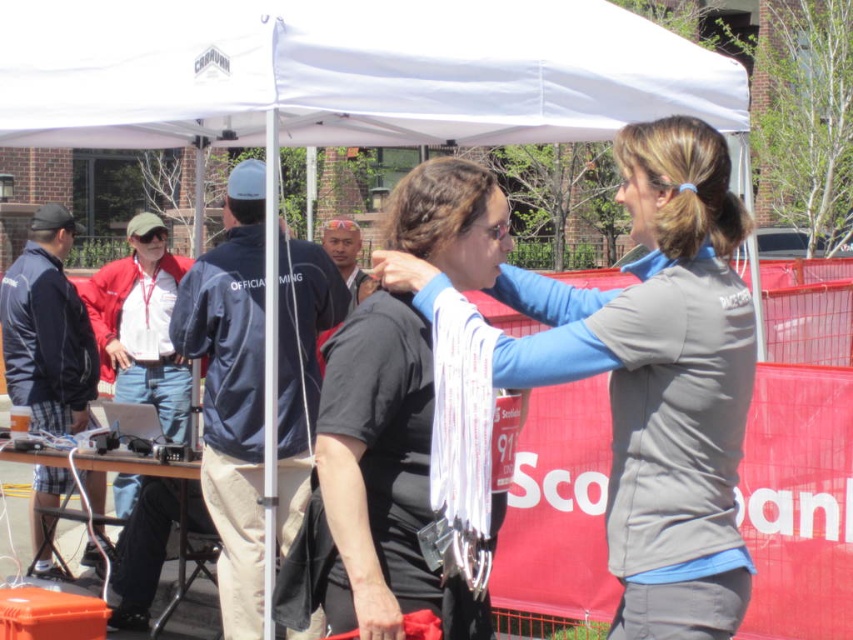
Looking at this image, is gray fabric jacket at center to the right of dark blue jacket at left from the viewer's perspective?

Indeed, gray fabric jacket at center is positioned on the right side of dark blue jacket at left.

Which is more to the left, gray fabric jacket at center or dark blue jacket at left?

dark blue jacket at left

Is point (730, 564) in front of point (67, 490)?

Yes, point (730, 564) is closer to viewer.

Find the location of a particular element. gray fabric jacket at center is located at coordinates (660, 380).

Who is lower down, navy blue fleece jacket at left or dark blue jacket at left?

navy blue fleece jacket at left

Is navy blue fleece jacket at left to the right of dark blue jacket at left from the viewer's perspective?

Yes, navy blue fleece jacket at left is to the right of dark blue jacket at left.

Is point (221, 593) positioned in front of point (27, 401)?

Yes, point (221, 593) is in front of point (27, 401).

What are the coordinates of `navy blue fleece jacket at left` in the screenshot? It's located at (231, 394).

Can you confirm if gray fabric jacket at center is smaller than navy blue fleece jacket at left?

Yes.

Between point (659, 460) and point (219, 468), which one is positioned in front?

Point (659, 460) is in front.

Measure the distance between gray fabric jacket at center and camera.

The distance of gray fabric jacket at center from camera is 3.07 meters.

Image resolution: width=853 pixels, height=640 pixels. Identify the location of gray fabric jacket at center. [x=660, y=380].